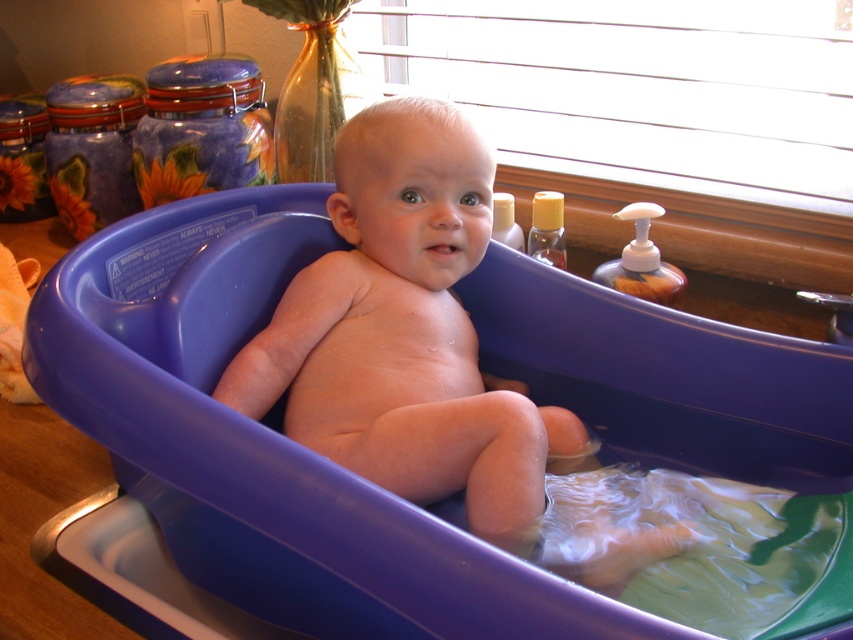
You are a parent preparing to give your baby a bath. You have a purple plastic tub at center and a translucent plastic soap dispenser at right. Which object should you pick up first to start the bath?

You should pick up the purple plastic tub at center first because it is larger in size than the translucent plastic soap dispenser at right, so it needs to be placed first to hold the water.

You are a parent checking the bath setup for your baby. You notice the purple plastic tub at center and the smooth plastic baby at center. Which object is positioned to the right of the other?

The purple plastic tub at center is to the right of the smooth plastic baby at center.